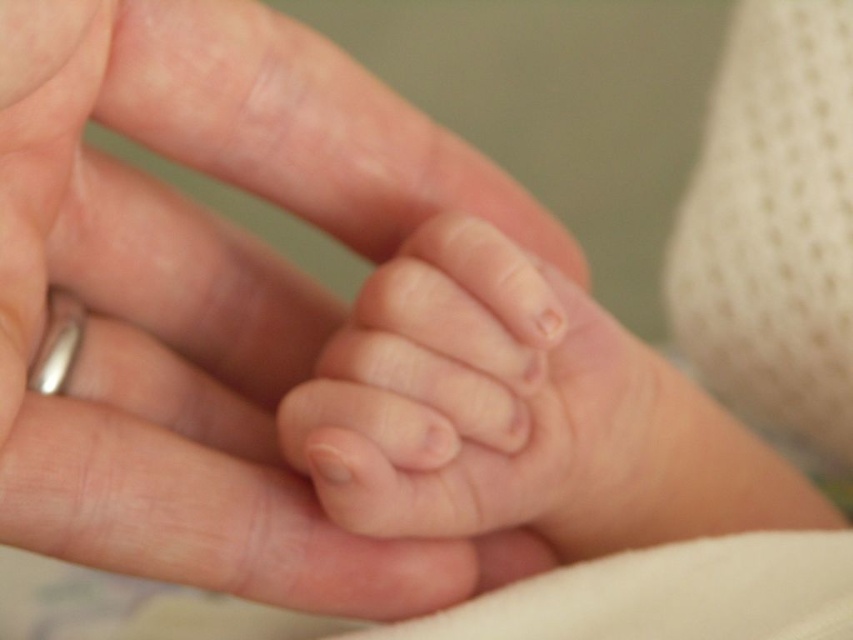
Question: Can you confirm if smooth skin hand at center is wider than smooth skin toe at center?

Choices:
 (A) yes
 (B) no

Answer: (A)

Question: Which object appears closest to the camera in this image?

Choices:
 (A) smooth skin toe at center
 (B) smooth skin hand at center

Answer: (B)

Question: Which point appears farthest from the camera in this image?

Choices:
 (A) click(x=73, y=452)
 (B) click(x=450, y=237)

Answer: (B)

Question: Considering the relative positions of smooth skin hand at center and smooth skin toe at center in the image provided, where is smooth skin hand at center located with respect to smooth skin toe at center?

Choices:
 (A) below
 (B) above

Answer: (A)

Question: Is the position of smooth skin hand at center less distant than that of smooth skin toe at center?

Choices:
 (A) no
 (B) yes

Answer: (B)